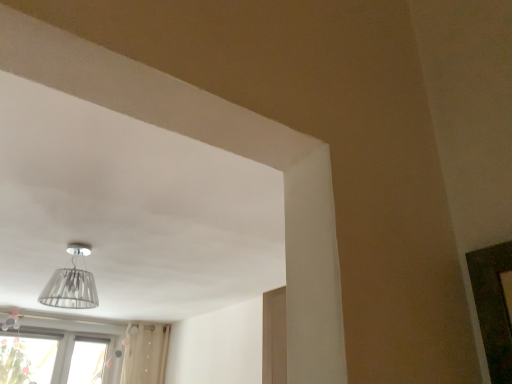
Question: In terms of width, does transparent glass window at lower left look wider or thinner when compared to transparent glass lampshade at upper center?

Choices:
 (A) wide
 (B) thin

Answer: (B)

Question: Looking at the image, does transparent glass window at lower left seem bigger or smaller compared to transparent glass lampshade at upper center?

Choices:
 (A) small
 (B) big

Answer: (B)

Question: Would you say transparent glass window at lower left is inside or outside transparent glass lampshade at upper center?

Choices:
 (A) outside
 (B) inside

Answer: (A)

Question: Is transparent glass lampshade at upper center spatially inside transparent glass window at lower left, or outside of it?

Choices:
 (A) inside
 (B) outside

Answer: (B)

Question: Considering the positions of transparent glass lampshade at upper center and transparent glass window at lower left in the image, is transparent glass lampshade at upper center wider or thinner than transparent glass window at lower left?

Choices:
 (A) wide
 (B) thin

Answer: (A)

Question: From their relative heights in the image, would you say transparent glass lampshade at upper center is taller or shorter than transparent glass window at lower left?

Choices:
 (A) short
 (B) tall

Answer: (A)

Question: From a real-world perspective, is transparent glass lampshade at upper center positioned above or below transparent glass window at lower left?

Choices:
 (A) above
 (B) below

Answer: (A)